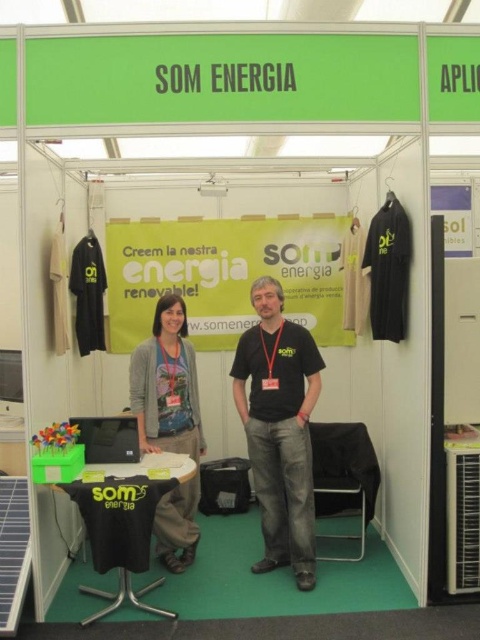
You are at the SOM ENERGIA booth and need to locate two points marked in the image. The first point is at coordinate point [300,513] and the second is at point [136,420]. Which of these points is positioned further back from the viewer?

Point [300,513] is behind point [136,420], so the first point is further back from the viewer.